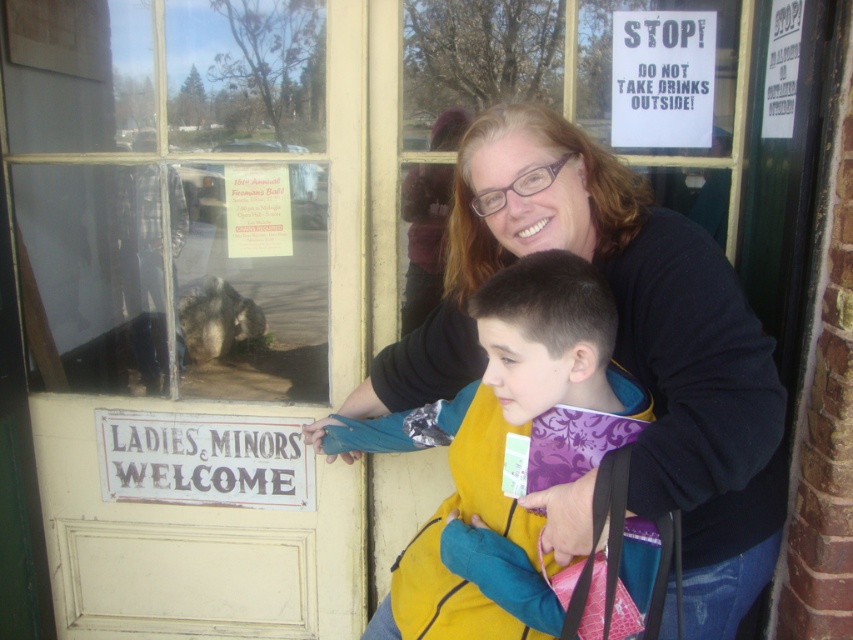
Who is positioned more to the left, white painted wood door at center or white paper sign at upper right?

From the viewer's perspective, white painted wood door at center appears more on the left side.

In order to click on white painted wood door at center in this screenshot , I will do `click(190, 301)`.

Identify the location of white painted wood door at center. (190, 301).

Is yellow fleece vest at center to the left of white painted wood sign at lower left from the viewer's perspective?

Incorrect, yellow fleece vest at center is not on the left side of white painted wood sign at lower left.

Based on the photo, who is lower down, yellow fleece vest at center or white painted wood sign at lower left?

Positioned lower is white painted wood sign at lower left.

Describe the element at coordinates (502, 449) in the screenshot. I see `yellow fleece vest at center` at that location.

The height and width of the screenshot is (640, 853). I want to click on yellow fleece vest at center, so click(502, 449).

Is white painted wood door at center positioned at the back of white painted wood sign at lower left?

No, it is in front of white painted wood sign at lower left.

Can you confirm if white painted wood door at center is positioned below white painted wood sign at lower left?

No.

The height and width of the screenshot is (640, 853). I want to click on white painted wood door at center, so click(190, 301).